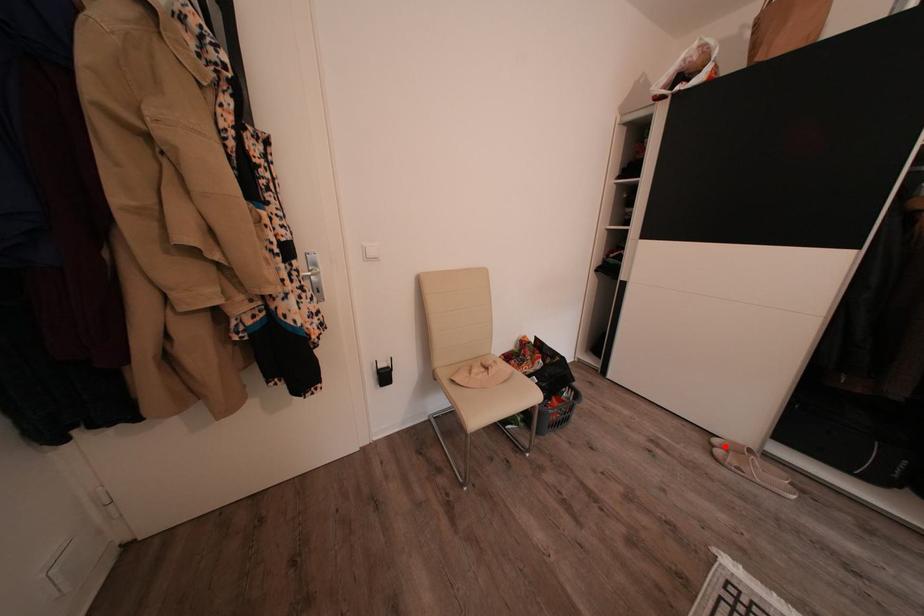
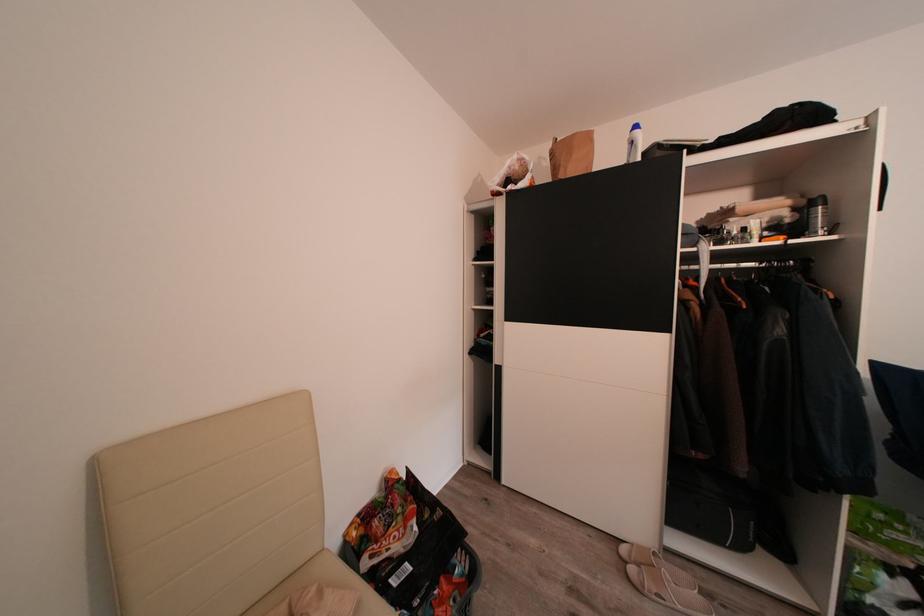
In the second image, find the point that corresponds to the highlighted location in the first image.

(631, 554)